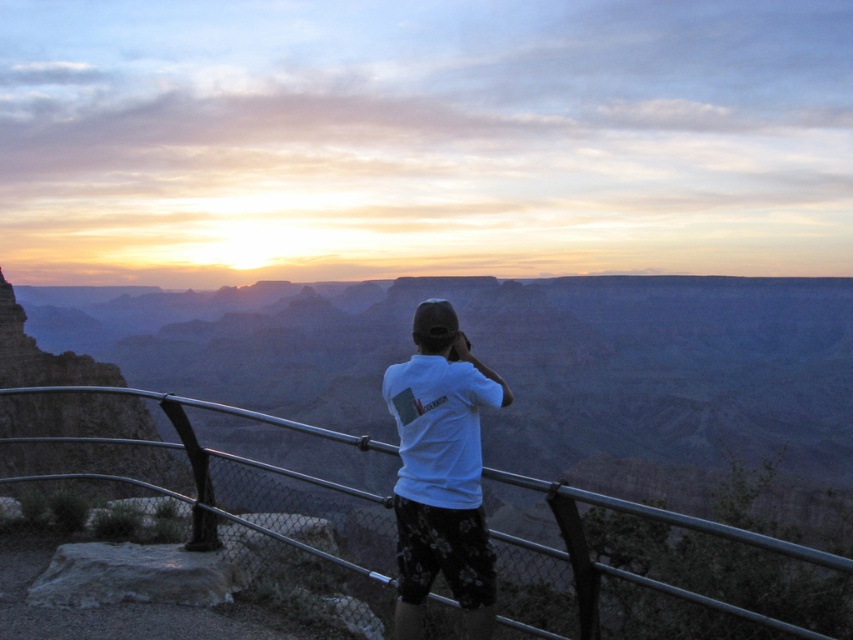
In the scene shown: You are standing at point (444, 364) and want to take a photo of the sunset. The camera is 16.92 meters away from you. Can you reach the camera in time before the sunset disappears?

The camera is 16.92 meters away from point (444, 364), so you can reach it in time before the sunset disappears if you move quickly.

You are a photographer trying to capture the sunset at the Grand Canyon. You have a camera with a 50mm lens. The white cotton shirt at center is 17.80 meters from the metallic gray rail at center. To ensure both the shirt and the rail are in focus, what is the minimum distance you should set your hyperfocal distance?

The hyperfocal distance should be set to approximately half the distance between the shirt and the rail, so around 8.9 meters. This ensures both objects are in focus with a 50mm lens.

You are standing at the Grand Canyon viewpoint and see two points marked in the image. The first point is at coordinates point (450, 435) and the second is at point (705, 529). Which point is closer to you?

Point (450, 435) is further to the viewer than point (705, 529), so the second point is closer to you.